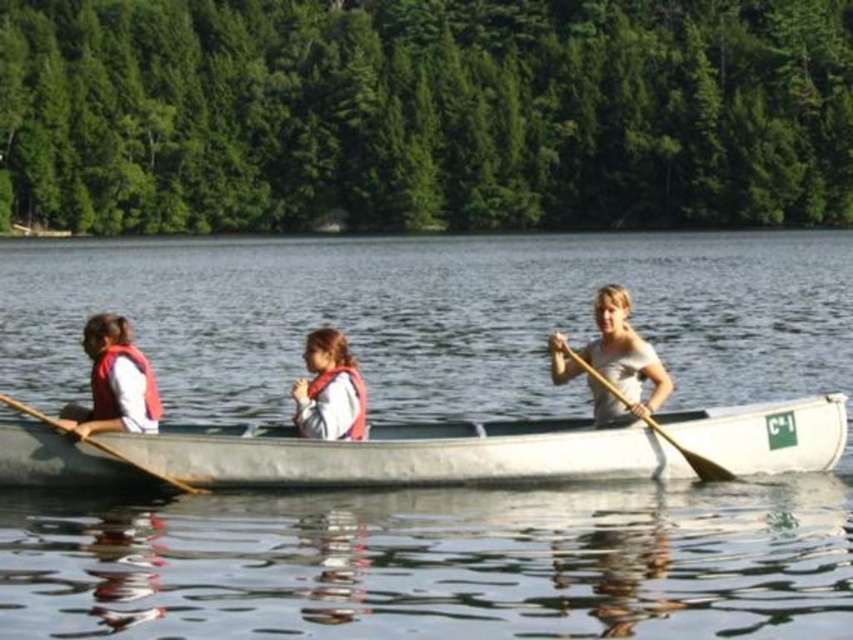
You are standing on the shore of the lake and see the point marked at coordinates (405, 454). What object is located at that point?

The white plastic canoe at center is located at point (405, 454).

You are a safety inspector checking the canoe setup. Based on the scene, which object is higher in elevation between the clear water at center and the white cotton shirt at center?

The clear water at center has a greater height compared to the white cotton shirt at center, so the clear water at center is higher in elevation.